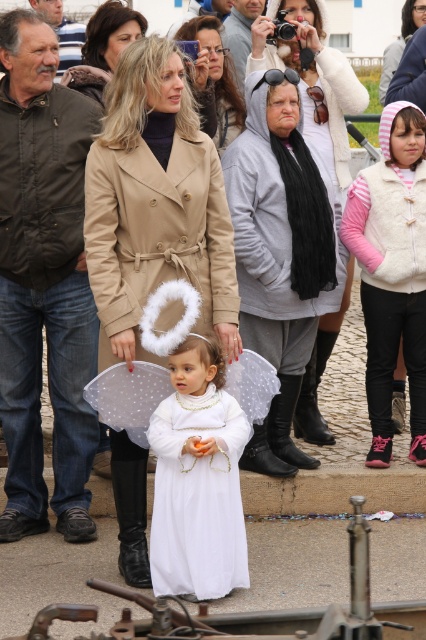
Does dark brown leather jacket at left appear over white satin dress at center?

Yes.

Does dark brown leather jacket at left have a greater height compared to white satin dress at center?

Yes.

Is point (63, 360) less distant than point (190, 550)?

No, (63, 360) is behind (190, 550).

The height and width of the screenshot is (640, 426). What are the coordinates of `dark brown leather jacket at left` in the screenshot? It's located at (43, 282).

Which of these two, dark brown leather jacket at left or gray hoodie at center, stands taller?

dark brown leather jacket at left is taller.

Between dark brown leather jacket at left and gray hoodie at center, which one is positioned higher?

gray hoodie at center

The image size is (426, 640). I want to click on dark brown leather jacket at left, so click(x=43, y=282).

Who is higher up, beige wool coat at center or white satin dress at center?

beige wool coat at center is higher up.

Is point (141, 294) positioned behind point (158, 557)?

Yes, it is behind point (158, 557).

Find the location of a particular element. The width and height of the screenshot is (426, 640). beige wool coat at center is located at coordinates (155, 204).